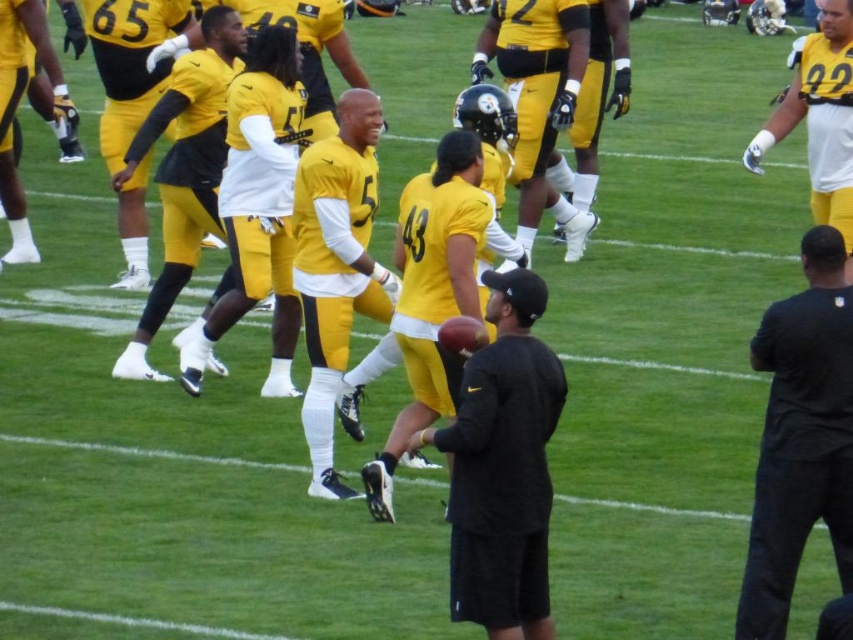
Find the location of a particular element. This screenshot has width=853, height=640. black matte football at center is located at coordinates (503, 467).

Is point (468, 554) behind point (334, 369)?

No.

Identify the location of black matte football at center. The height and width of the screenshot is (640, 853). (503, 467).

Is black matte shirt at center smaller than matte yellow jersey at upper right?

Correct, black matte shirt at center occupies less space than matte yellow jersey at upper right.

Is the position of black matte shirt at center more distant than that of matte yellow jersey at upper right?

That is False.

Between point (759, 621) and point (822, 132), which one is positioned in front?

Point (759, 621) is more forward.

This screenshot has height=640, width=853. I want to click on black matte shirt at center, so click(801, 436).

This screenshot has height=640, width=853. Describe the element at coordinates (503, 467) in the screenshot. I see `black matte football at center` at that location.

Is black matte football at center wider than black matte shirt at center?

Indeed, black matte football at center has a greater width compared to black matte shirt at center.

At what (x,y) coordinates should I click in order to perform the action: click on black matte football at center. Please return your answer as a coordinate pair (x, y). Image resolution: width=853 pixels, height=640 pixels. Looking at the image, I should click on (503, 467).

The height and width of the screenshot is (640, 853). What are the coordinates of `black matte football at center` in the screenshot? It's located at (503, 467).